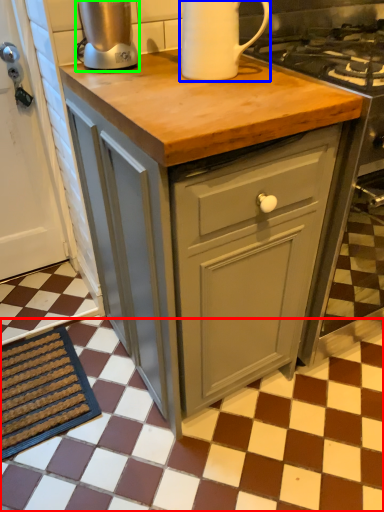
Question: Which is nearer to the tile (highlighted by a red box)? kitchen appliance (highlighted by a blue box) or kitchen appliance (highlighted by a green box).

Choices:
 (A) kitchen appliance
 (B) kitchen appliance

Answer: (A)